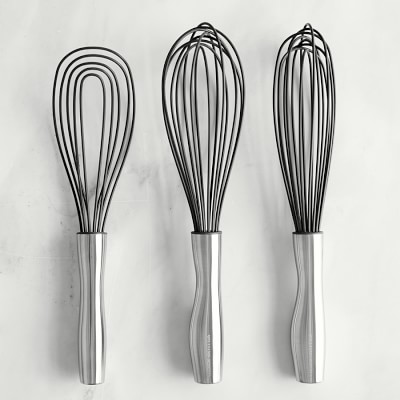
Find the location of `normal whisk`. normal whisk is located at coordinates (216, 48).